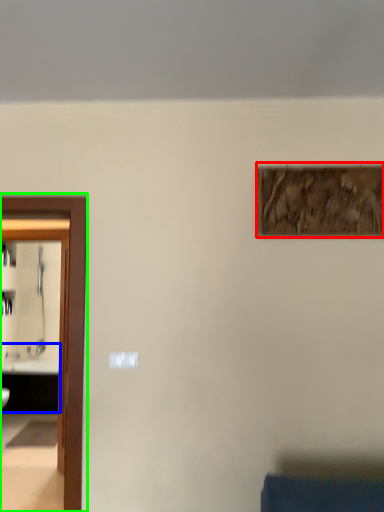
Question: Based on their relative distances, which object is nearer to picture frame (highlighted by a red box)? Choose from sink (highlighted by a blue box) and elevator (highlighted by a green box).

Choices:
 (A) sink
 (B) elevator

Answer: (B)